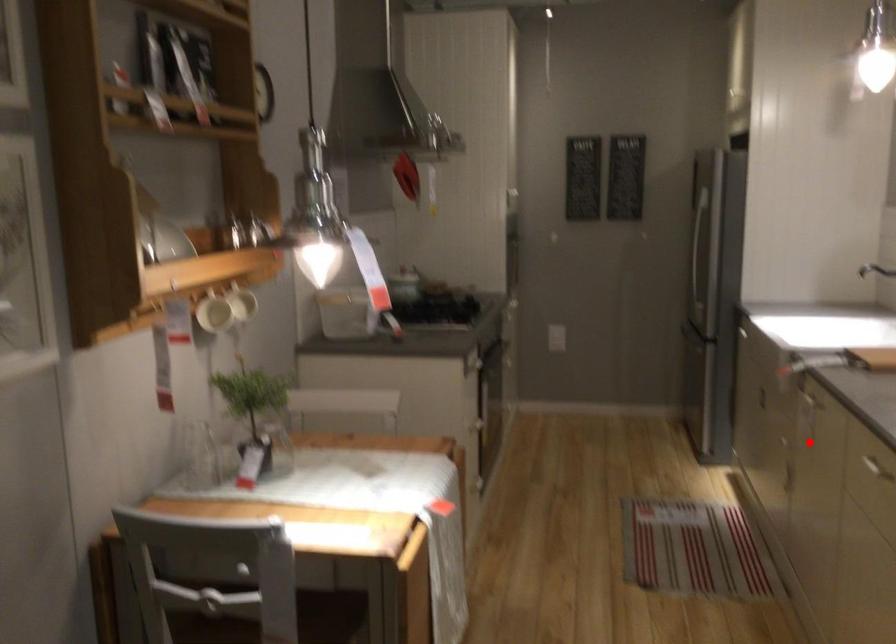
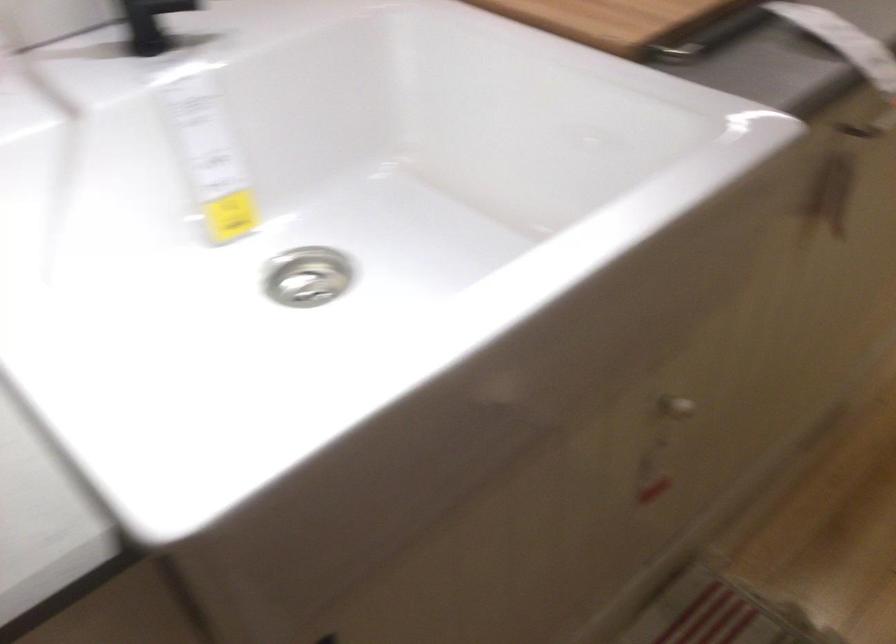
Locate, in the second image, the point that corresponds to the highlighted location in the first image.

(675, 408)